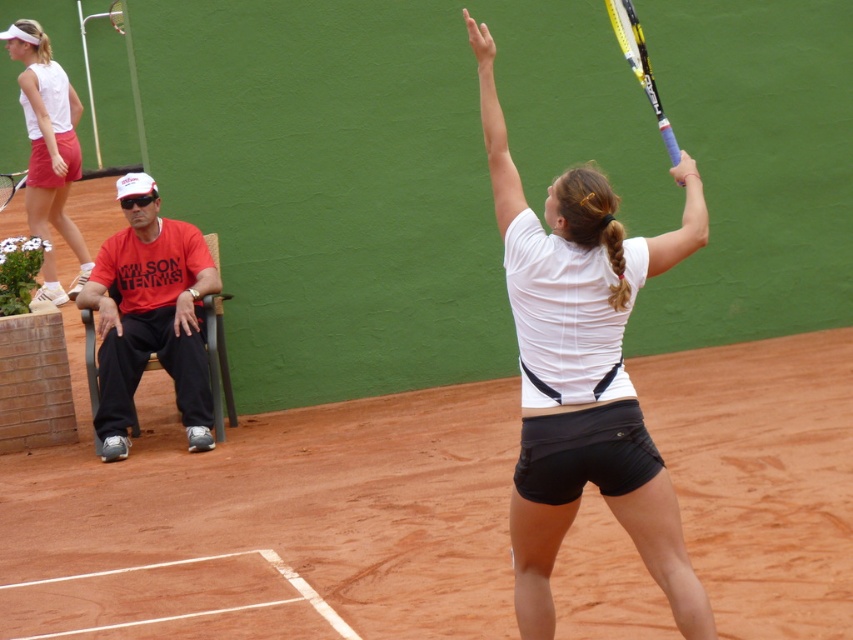
You are a photographer trying to capture the tennis player serving. You notice the clay tennis court at center and the white matte tennis racket at upper center in your viewfinder. Which object takes up more area in the image?

The white matte tennis racket at upper center occupies more space in the image than the clay tennis court at center according to the description.

You are a tennis coach observing the match and want to retrieve the racket that is closer to you. Which racket should you choose between the white matte tennis racket at upper center and the black matte tennis racket at upper center?

The white matte tennis racket at upper center is closer to the viewer, so you should choose that one.

Consider the image. You are a tennis instructor observing the scene. You notice the clay tennis court at center and the white matte tennis racket at upper center. Which object is positioned higher from the ground?

The white matte tennis racket at upper center is positioned higher from the ground than the clay tennis court at center.